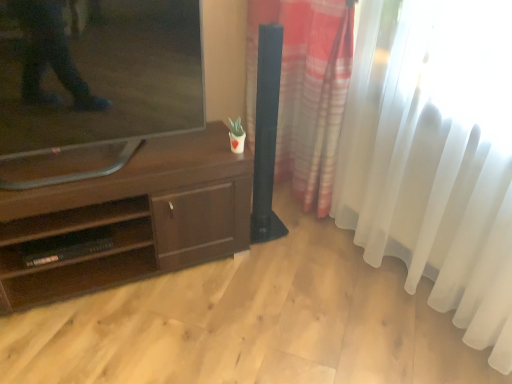
Question: From a real-world perspective, is black plastic shelf at lower left positioned above or below dark brown wood tv stand at center?

Choices:
 (A) above
 (B) below

Answer: (B)

Question: Is black plastic shelf at lower left in front of or behind dark brown wood tv stand at center in the image?

Choices:
 (A) behind
 (B) front

Answer: (A)

Question: Estimate the real-world distances between objects in this image. Which object is closer to the matte black tv at left?

Choices:
 (A) translucent fabric curtain at right
 (B) black plastic shelf at lower left
 (C) dark brown wood tv stand at center

Answer: (C)

Question: Which object is positioned closest to the matte black tv at left?

Choices:
 (A) black plastic shelf at lower left
 (B) translucent fabric curtain at right
 (C) dark brown wood tv stand at center

Answer: (C)